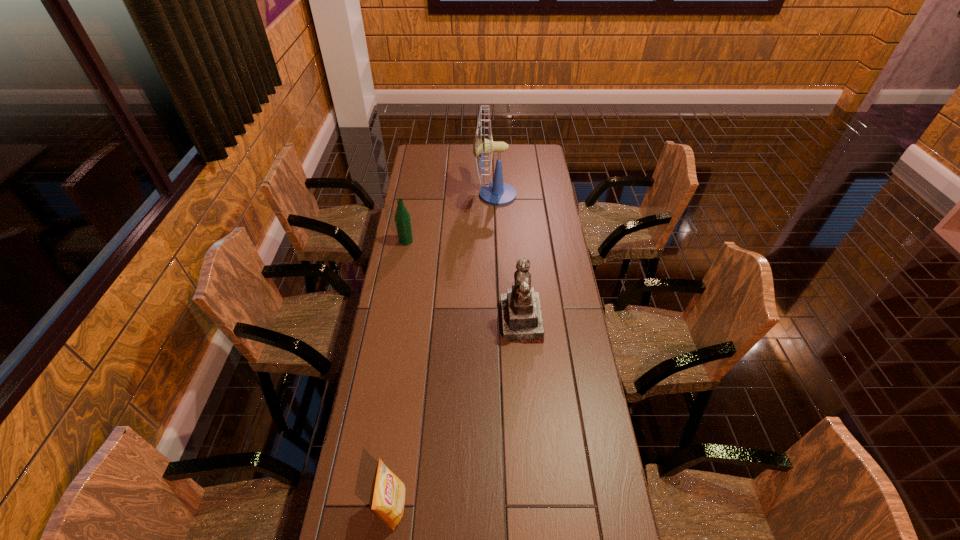
Locate an element on the screen. The height and width of the screenshot is (540, 960). blank space located at the front of the tallest object where the blades are visible is located at coordinates (409, 195).

Image resolution: width=960 pixels, height=540 pixels. What are the coordinates of `free space located 0.320m on the front-facing side of the figurine` in the screenshot? It's located at (415, 321).

Identify the location of free region located 0.250m on the front-facing side of the figurine. point(433,321).

The image size is (960, 540). I want to click on free location located 0.220m on the front-facing side of the figurine, so click(442, 321).

Find the location of a particular element. The width and height of the screenshot is (960, 540). blank space located 0.400m on the front of the second shortest object is located at coordinates (393, 319).

I want to click on vacant space situated on the front-facing side of the shortest object, so click(432, 505).

At what (x,y) coordinates should I click in order to perform the action: click on bottle that is positioned at the left edge. Please return your answer as a coordinate pair (x, y). This screenshot has height=540, width=960. Looking at the image, I should click on [x=402, y=217].

You are a GUI agent. You are given a task and a screenshot of the screen. Output one action in this format:
    pyautogui.click(x=<x>, y=<y>)
    Task: Click on the crisp (potato chip) present at the left edge
    The image size is (960, 540).
    Given the screenshot: What is the action you would take?
    pyautogui.click(x=387, y=498)

Where is `object that is at the right edge`? The width and height of the screenshot is (960, 540). object that is at the right edge is located at coordinates (522, 321).

Where is `blank area at the far edge`? blank area at the far edge is located at coordinates (463, 146).